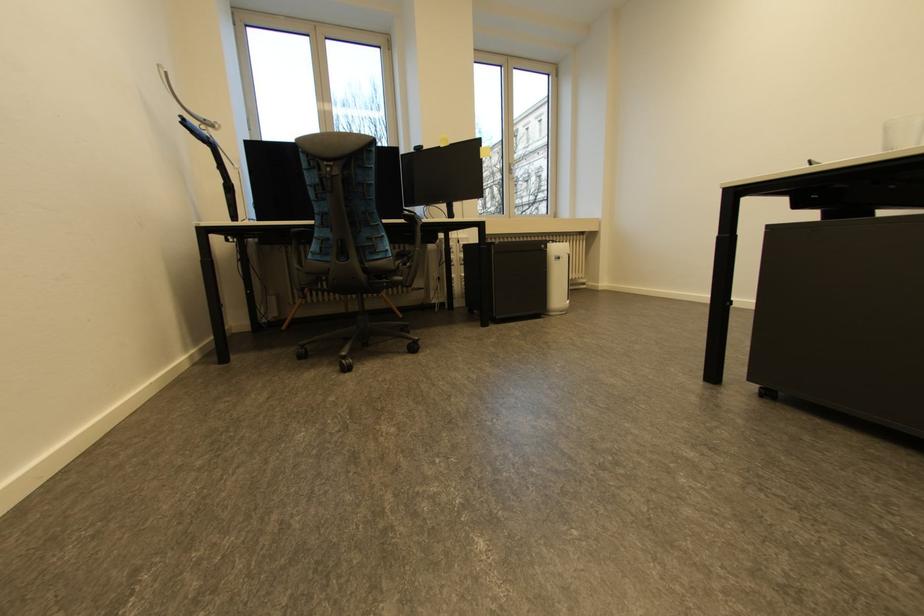
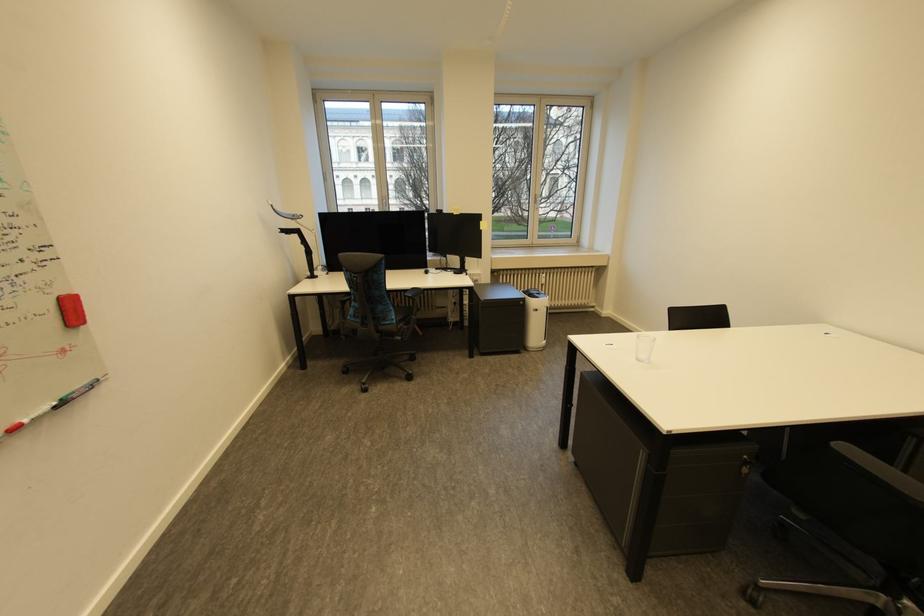
The point at (x=565, y=259) is marked in the first image. Where is the corresponding point in the second image?

(543, 310)